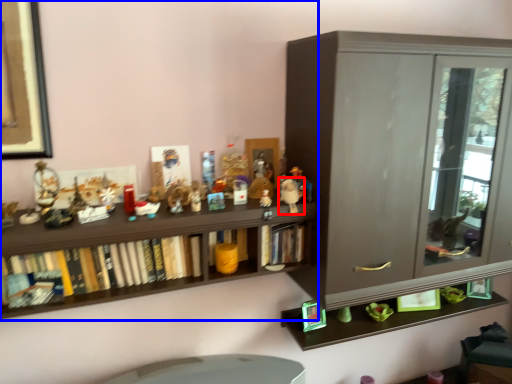
Question: Which object appears closest to the camera in this image, toy (highlighted by a red box) or shelf (highlighted by a blue box)?

Choices:
 (A) toy
 (B) shelf

Answer: (B)